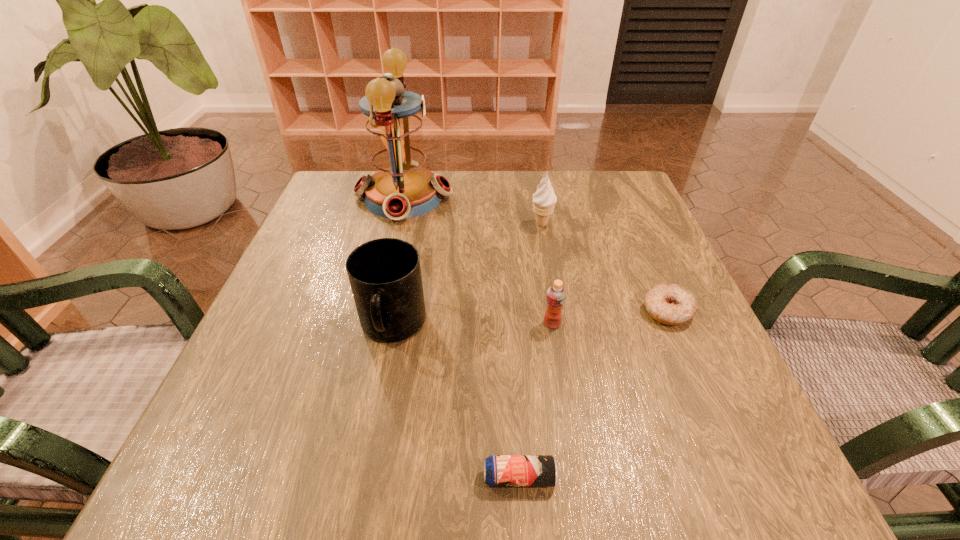
Where is `the tallest object`? the tallest object is located at coordinates (401, 187).

You are a GUI agent. You are given a task and a screenshot of the screen. Output one action in this format:
    pyautogui.click(x=<x>, y=<y>)
    Task: Click on the mug
    The height and width of the screenshot is (540, 960).
    Given the screenshot: What is the action you would take?
    pyautogui.click(x=385, y=277)

I want to click on icecream, so click(x=544, y=199).

The width and height of the screenshot is (960, 540). What are the coordinates of `orange juice` in the screenshot? It's located at (556, 295).

I want to click on the rightmost object, so click(x=667, y=303).

At what (x,y) coordinates should I click in order to perform the action: click on beer can. Please return your answer as a coordinate pair (x, y). Looking at the image, I should click on (499, 470).

I want to click on the fourth object from right to left, so click(x=499, y=470).

In order to click on free region located 0.140m on the front-facing side of the tallest object in this screenshot , I will do `click(508, 197)`.

Where is `vacant space located 0.210m on the side of the mug with the handle`? This screenshot has width=960, height=540. vacant space located 0.210m on the side of the mug with the handle is located at coordinates (360, 494).

In order to click on free location located on the front-facing side of the icecream in this screenshot , I will do `click(556, 303)`.